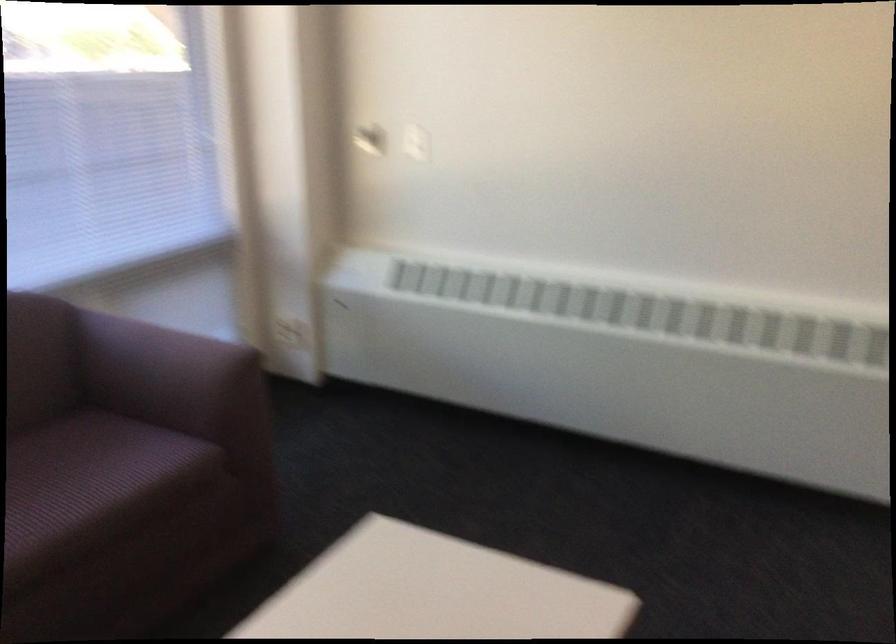
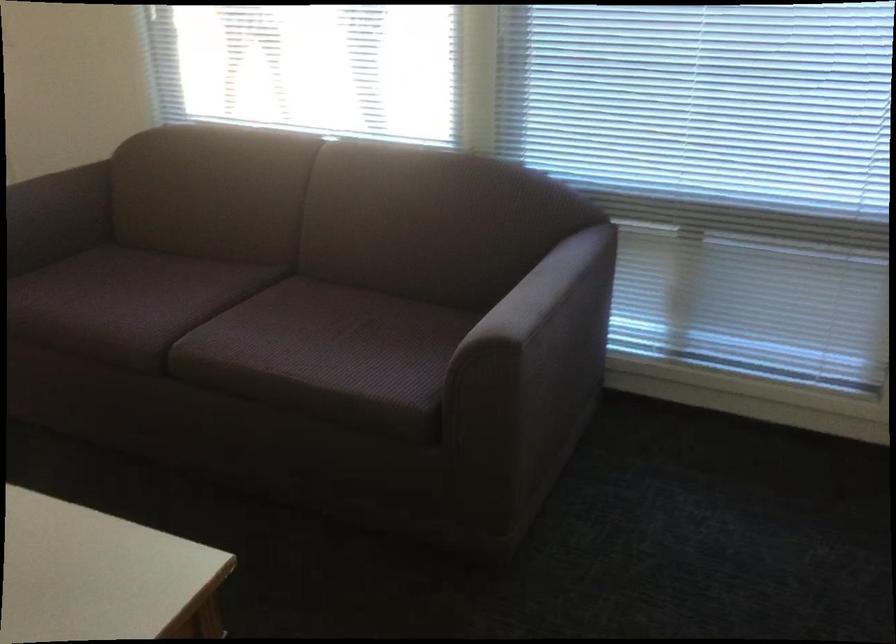
Locate, in the second image, the point that corresponds to point (179, 337) in the first image.

(545, 294)